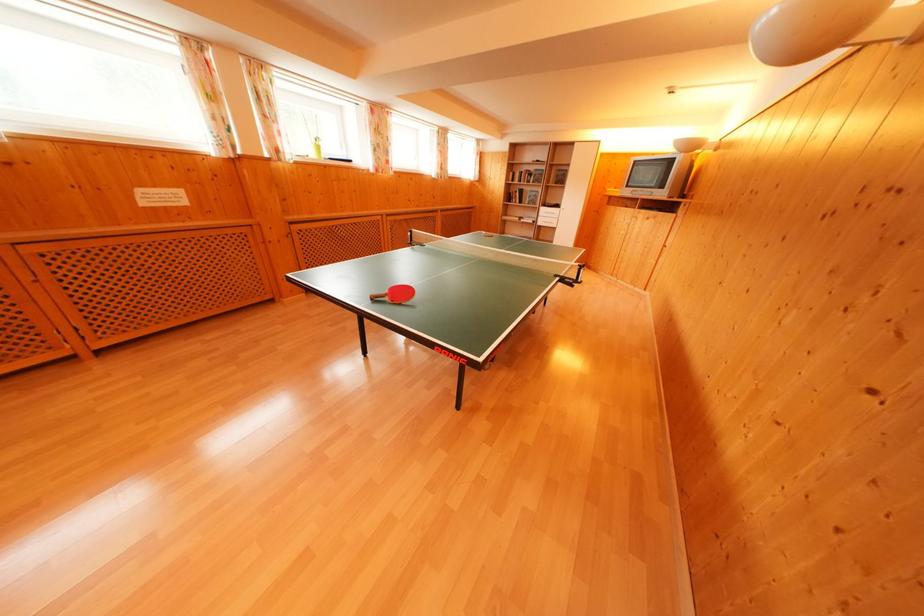
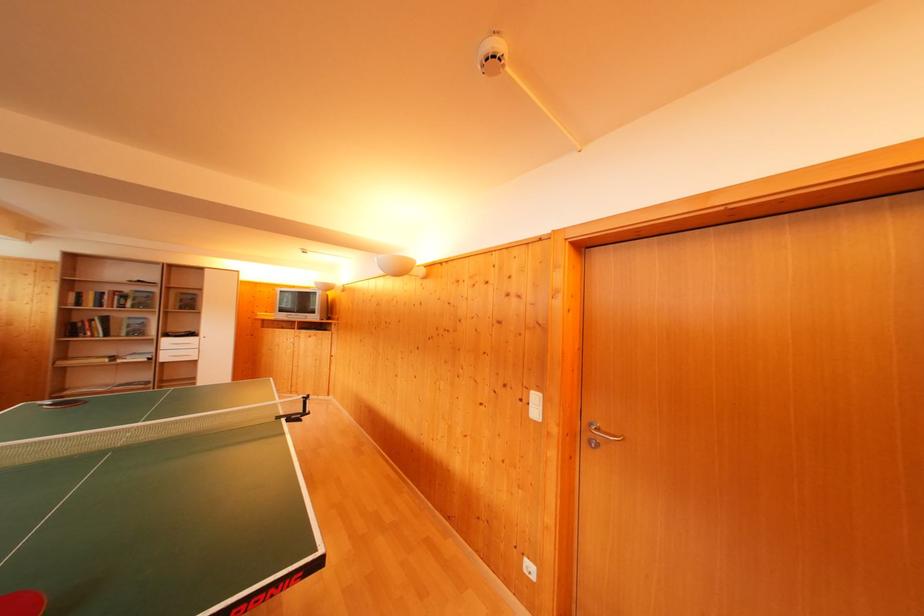
Where in the second image is the point corresponding to pixel 529 174 from the first image?

(112, 294)